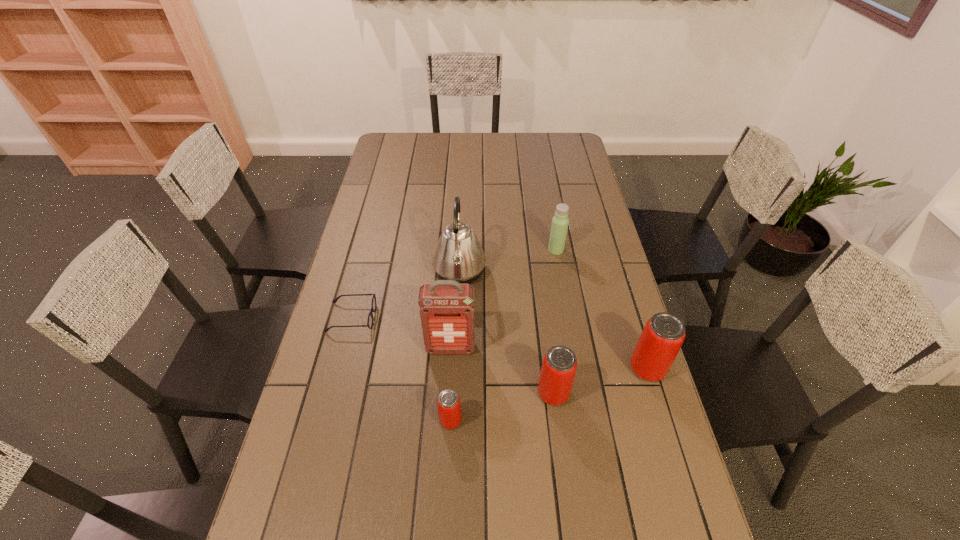
Locate an element on the screen. The image size is (960, 540). free region that satisfies the following two spatial constraints: 1. on the front-facing side of the leftmost object; 2. on the left side of the second beer can from left to right is located at coordinates (332, 393).

Image resolution: width=960 pixels, height=540 pixels. I want to click on vacant space that satisfies the following two spatial constraints: 1. on the front-facing side of the sixth tallest object; 2. on the right side of the third farthest object, so click(324, 420).

The image size is (960, 540). I want to click on free spot that satisfies the following two spatial constraints: 1. from the spout of the kettle; 2. on the left side of the rightmost beer can, so click(x=455, y=369).

Locate an element on the screen. The image size is (960, 540). vacant position in the image that satisfies the following two spatial constraints: 1. from the spout of the second tallest beer can; 2. on the left side of the kettle is located at coordinates (454, 393).

Find the location of a particular element. The height and width of the screenshot is (540, 960). vacant space that satisfies the following two spatial constraints: 1. on the front-facing side of the first-aid kit; 2. on the right side of the rightmost object is located at coordinates (449, 369).